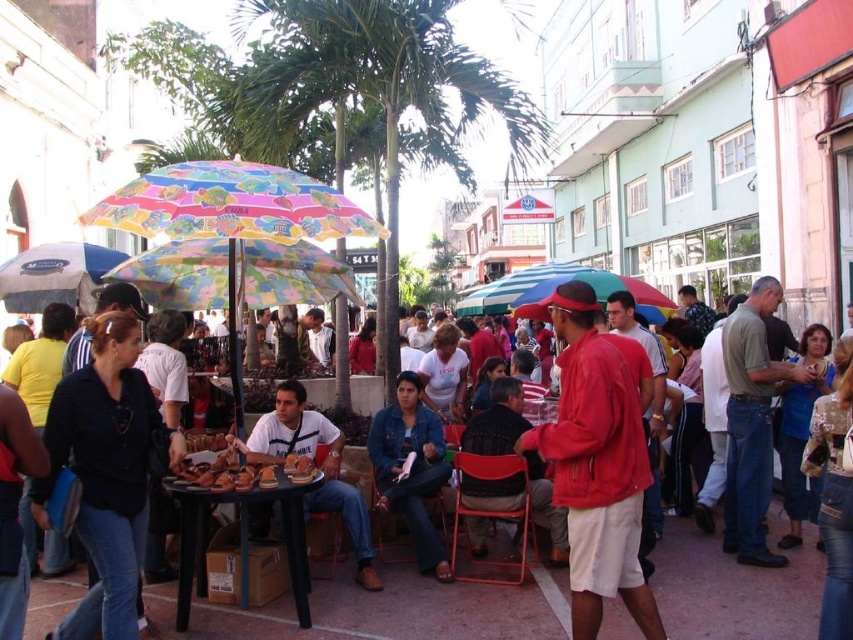
Question: In this image, where is green leafy palm tree at center located relative to wooden table at center?

Choices:
 (A) right
 (B) left

Answer: (A)

Question: Which object is positioned closest to the dark gray sweater at center?

Choices:
 (A) denim jacket at center
 (B) dark blue denim jeans at center

Answer: (A)

Question: Does denim jacket at center come behind matte blue umbrella at left?

Choices:
 (A) no
 (B) yes

Answer: (A)

Question: Among these objects, which one is nearest to the camera?

Choices:
 (A) wooden table at center
 (B) denim jacket at center

Answer: (A)

Question: Which point is closer to the camera?

Choices:
 (A) (401, 400)
 (B) (321, 419)

Answer: (B)

Question: Can you confirm if white cotton shirt at center is thinner than dark gray sweater at center?

Choices:
 (A) yes
 (B) no

Answer: (B)